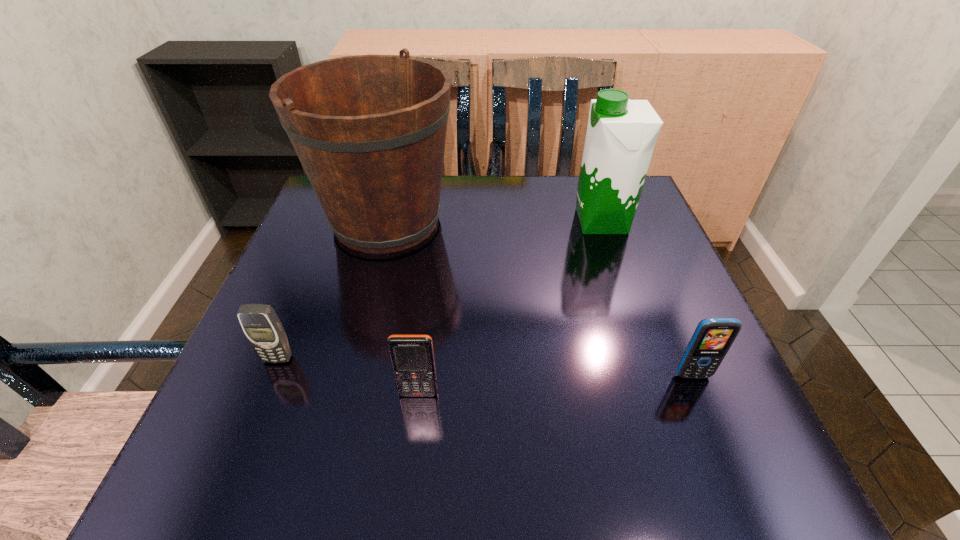
Identify the location of free location located 0.110m on the front-facing side of the soya milk. The image size is (960, 540). (527, 221).

The image size is (960, 540). What are the coordinates of `free spot located on the front-facing side of the soya milk` in the screenshot? It's located at (522, 221).

Find the location of `vacant region located 0.120m on the screen of the nearest object`. vacant region located 0.120m on the screen of the nearest object is located at coordinates (409, 474).

This screenshot has height=540, width=960. I want to click on vacant space located 0.170m on the screen of the fourth farthest object, so click(739, 488).

This screenshot has height=540, width=960. I want to click on vacant region located 0.200m on the front face of the leftmost cellular telephone, so click(226, 487).

This screenshot has width=960, height=540. I want to click on bucket that is at the far edge, so click(369, 130).

What are the coordinates of `soya milk at the far edge` in the screenshot? It's located at (621, 135).

Image resolution: width=960 pixels, height=540 pixels. I want to click on bucket at the left edge, so click(x=369, y=130).

Locate an element on the screen. This screenshot has height=540, width=960. cellular telephone at the left edge is located at coordinates (260, 323).

Where is `soya milk at the right edge`? soya milk at the right edge is located at coordinates pos(621,135).